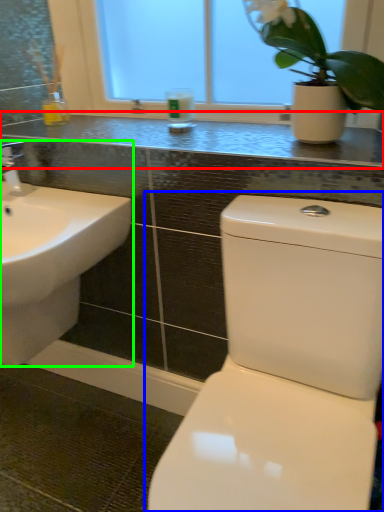
Question: Which is nearer to the counter top (highlighted by a red box)? toilet (highlighted by a blue box) or sink (highlighted by a green box).

Choices:
 (A) toilet
 (B) sink

Answer: (B)